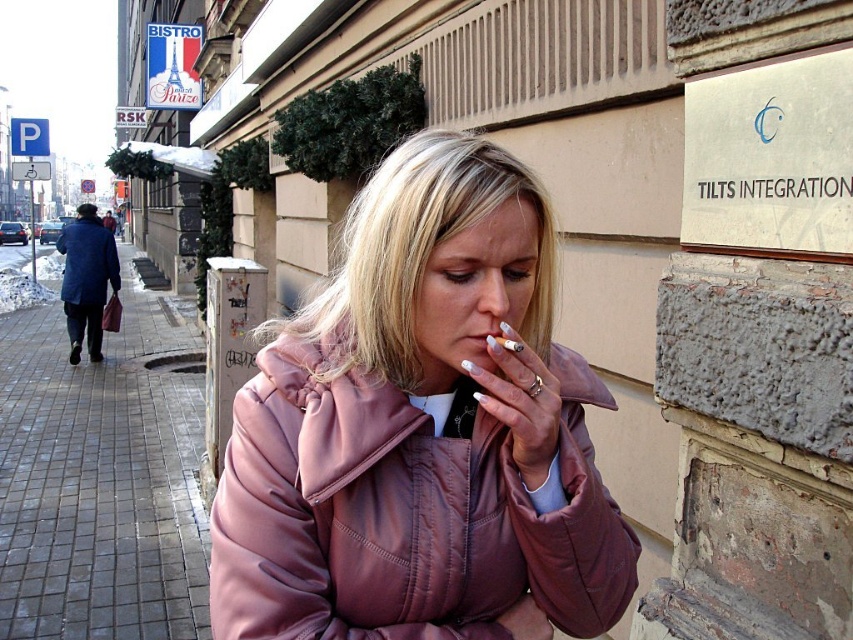
Question: Does matte pink leather jacket at center have a smaller size compared to white matte cigarette at center?

Choices:
 (A) yes
 (B) no

Answer: (B)

Question: Which point is closer to the camera taking this photo?

Choices:
 (A) (524, 429)
 (B) (99, 225)

Answer: (A)

Question: In this image, where is matte pink leather jacket at center located relative to blue wool coat at left?

Choices:
 (A) below
 (B) above

Answer: (A)

Question: Is matte pink leather jacket at center to the right of white matte cigarette at center from the viewer's perspective?

Choices:
 (A) yes
 (B) no

Answer: (B)

Question: Which object appears farthest from the camera in this image?

Choices:
 (A) gray brick pavement at lower left
 (B) matte pink leather jacket at center
 (C) blue wool coat at left

Answer: (C)

Question: Among these points, which one is nearest to the camera?

Choices:
 (A) (x=175, y=620)
 (B) (x=450, y=324)
 (C) (x=497, y=342)

Answer: (C)